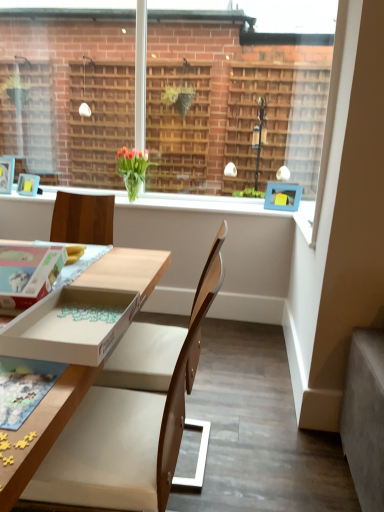
The width and height of the screenshot is (384, 512). What do you see at coordinates (133, 169) in the screenshot?
I see `translucent glass vase at upper center` at bounding box center [133, 169].

Describe the element at coordinates (70, 325) in the screenshot. The image size is (384, 512). I see `white cardboard box at lower left, arranged as the second box when viewed from the left` at that location.

In order to click on brick wall at upper center in this screenshot , I will do 236,96.

From a real-world perspective, relative to wooden chair at center, is translucent glass vase at upper center vertically above or below?

translucent glass vase at upper center is above wooden chair at center.

Is translucent glass vase at upper center to the left of wooden chair at center from the viewer's perspective?

Yes.

Can you confirm if translucent glass vase at upper center is bigger than wooden chair at center?

No.

Which object is positioned more to the left, cardboard box at lower left, arranged as the 2th box when viewed from the right, or wooden chair at center?

cardboard box at lower left, arranged as the 2th box when viewed from the right, is more to the left.

Which point is more forward, (30, 301) or (128, 362)?

The point (30, 301) is closer to the camera.

Considering the sizes of cardboard box at lower left, placed as the 1th box when sorted from left to right, and wooden chair at center in the image, is cardboard box at lower left, placed as the 1th box when sorted from left to right, wider or thinner than wooden chair at center?

cardboard box at lower left, placed as the 1th box when sorted from left to right, is thinner than wooden chair at center.

From a real-world perspective, is wooden chair at center physically below translucent glass vase at upper center?

Yes, from a real-world perspective, wooden chair at center is beneath translucent glass vase at upper center.

Which of these two, wooden chair at center or translucent glass vase at upper center, is bigger?

Bigger between the two is wooden chair at center.

Considering the positions of objects wooden chair at center and translucent glass vase at upper center in the image provided, who is in front, wooden chair at center or translucent glass vase at upper center?

wooden chair at center is more forward.

From the image's perspective, between wooden chair at center and translucent glass vase at upper center, which one is located above?

translucent glass vase at upper center appears higher in the image.

Does white cardboard box at lower left, the first box when ordered from right to left, touch brick wall at upper center?

No, white cardboard box at lower left, the first box when ordered from right to left, is not touching brick wall at upper center.

Considering the relative positions of white cardboard box at lower left, the first box when ordered from right to left, and brick wall at upper center in the image provided, is white cardboard box at lower left, the first box when ordered from right to left, to the left or to the right of brick wall at upper center?

Based on their positions, white cardboard box at lower left, the first box when ordered from right to left, is located to the left of brick wall at upper center.

Can you confirm if white cardboard box at lower left, the first box when ordered from right to left, is positioned to the right of cardboard box at lower left, placed as the 1th box when sorted from left to right?

Yes.

Which is closer to the camera, (x=72, y=298) or (x=16, y=282)?

Point (x=72, y=298) is farther from the camera than point (x=16, y=282).

How different are the orientations of white cardboard box at lower left, the first box when ordered from right to left, and cardboard box at lower left, arranged as the 2th box when viewed from the right, in degrees?

The angular difference between white cardboard box at lower left, the first box when ordered from right to left, and cardboard box at lower left, arranged as the 2th box when viewed from the right, is 176 degrees.

Considering the sizes of objects white cardboard box at lower left, arranged as the second box when viewed from the left, and cardboard box at lower left, placed as the 1th box when sorted from left to right, in the image provided, who is shorter, white cardboard box at lower left, arranged as the second box when viewed from the left, or cardboard box at lower left, placed as the 1th box when sorted from left to right,?

With less height is white cardboard box at lower left, arranged as the second box when viewed from the left.

Considering the sizes of objects wooden chair at center and cardboard box at lower left, arranged as the 2th box when viewed from the right, in the image provided, who is taller, wooden chair at center or cardboard box at lower left, arranged as the 2th box when viewed from the right,?

wooden chair at center.

From a real-world perspective, who is located lower, wooden chair at center or cardboard box at lower left, placed as the 1th box when sorted from left to right?

From a 3D spatial view, wooden chair at center is below.

Considering the relative sizes of wooden chair at center and cardboard box at lower left, arranged as the 2th box when viewed from the right, in the image provided, is wooden chair at center smaller than cardboard box at lower left, arranged as the 2th box when viewed from the right,?

No, wooden chair at center is not smaller than cardboard box at lower left, arranged as the 2th box when viewed from the right.

Is cardboard box at lower left, arranged as the 2th box when viewed from the right, completely or partially inside wooden chair at center?

No, cardboard box at lower left, arranged as the 2th box when viewed from the right, is not inside wooden chair at center.

Is the surface of translucent glass vase at upper center in direct contact with white cardboard box at lower left, arranged as the second box when viewed from the left?

translucent glass vase at upper center and white cardboard box at lower left, arranged as the second box when viewed from the left, are not in contact.

Is translucent glass vase at upper center positioned beyond the bounds of white cardboard box at lower left, arranged as the second box when viewed from the left?

Indeed, translucent glass vase at upper center is completely outside white cardboard box at lower left, arranged as the second box when viewed from the left.

Considering the positions of point (142, 167) and point (72, 348), is point (142, 167) closer or farther from the camera than point (72, 348)?

Clearly, point (142, 167) is more distant from the camera than point (72, 348).

Is translucent glass vase at upper center wider or thinner than white cardboard box at lower left, the first box when ordered from right to left?

translucent glass vase at upper center is thinner than white cardboard box at lower left, the first box when ordered from right to left.

Locate an element on the screen. This screenshot has height=512, width=384. chair below the translucent glass vase at upper center (from a real-world perspective) is located at coordinates (130, 432).

Where is `chair lying below the cardboard box at lower left, placed as the 1th box when sorted from left to right (from the image's perspective)`? This screenshot has width=384, height=512. chair lying below the cardboard box at lower left, placed as the 1th box when sorted from left to right (from the image's perspective) is located at coordinates (130, 432).

Considering their positions, is brick wall at upper center positioned closer to white cardboard box at lower left, arranged as the second box when viewed from the left, than translucent glass vase at upper center?

The object closer to white cardboard box at lower left, arranged as the second box when viewed from the left, is translucent glass vase at upper center.

When comparing their distances from wooden chair at center, does brick wall at upper center or cardboard box at lower left, arranged as the 2th box when viewed from the right, seem further?

brick wall at upper center is further to wooden chair at center.

Which object lies nearer to the anchor point brick wall at upper center, wooden chair at center or white cardboard box at lower left, the first box when ordered from right to left?

wooden chair at center lies closer to brick wall at upper center than the other object.

Estimate the real-world distances between objects in this image. Which object is closer to white cardboard box at lower left, arranged as the second box when viewed from the left, cardboard box at lower left, arranged as the 2th box when viewed from the right, or brick wall at upper center?

cardboard box at lower left, arranged as the 2th box when viewed from the right, is positioned closer to the anchor white cardboard box at lower left, arranged as the second box when viewed from the left.

Which object lies nearer to the anchor point brick wall at upper center, cardboard box at lower left, placed as the 1th box when sorted from left to right, or white cardboard box at lower left, the first box when ordered from right to left?

cardboard box at lower left, placed as the 1th box when sorted from left to right, is positioned closer to the anchor brick wall at upper center.

Looking at the image, which one is located closer to wooden chair at center, white cardboard box at lower left, arranged as the second box when viewed from the left, or cardboard box at lower left, placed as the 1th box when sorted from left to right?

Among the two, white cardboard box at lower left, arranged as the second box when viewed from the left, is located nearer to wooden chair at center.

Which object lies further to the anchor point brick wall at upper center, translucent glass vase at upper center or white cardboard box at lower left, the first box when ordered from right to left?

white cardboard box at lower left, the first box when ordered from right to left.

Which object lies further to the anchor point brick wall at upper center, translucent glass vase at upper center or wooden chair at center?

wooden chair at center.

Locate an element on the screen. The width and height of the screenshot is (384, 512). window located between cardboard box at lower left, arranged as the 2th box when viewed from the right, and translucent glass vase at upper center in the depth direction is located at coordinates (236, 96).

The image size is (384, 512). Identify the location of window positioned between white cardboard box at lower left, the first box when ordered from right to left, and translucent glass vase at upper center from near to far. (236, 96).

At what (x,y) coordinates should I click in order to perform the action: click on box between white cardboard box at lower left, the first box when ordered from right to left, and translucent glass vase at upper center in the front-back direction. Please return your answer as a coordinate pair (x, y). The height and width of the screenshot is (512, 384). Looking at the image, I should click on (28, 273).

The width and height of the screenshot is (384, 512). I want to click on box between wooden chair at center and cardboard box at lower left, placed as the 1th box when sorted from left to right, in the front-back direction, so click(x=70, y=325).